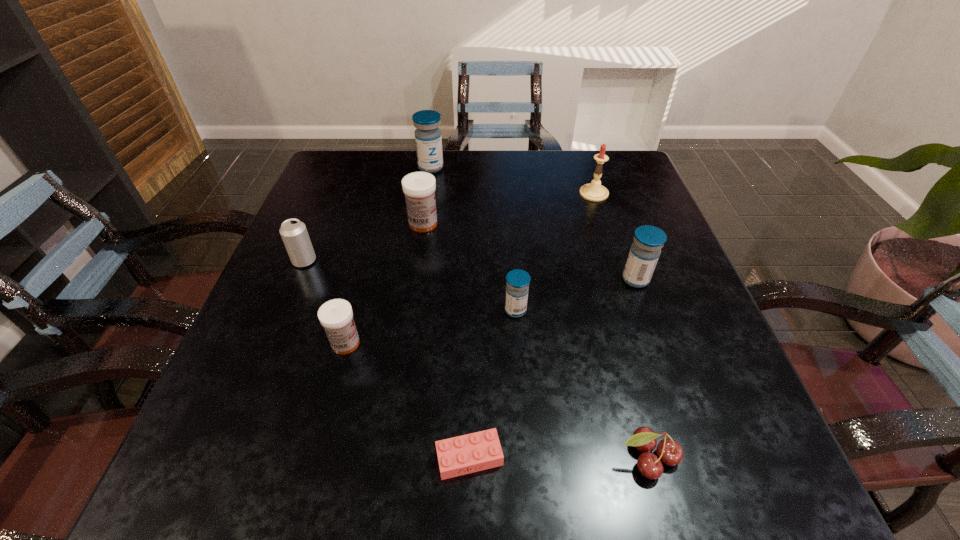
Locate an element on the screen. object that is at the left edge is located at coordinates (294, 234).

At what (x,y) coordinates should I click in order to perform the action: click on candle located at the right edge. Please return your answer as a coordinate pair (x, y). This screenshot has width=960, height=540. Looking at the image, I should click on (594, 191).

You are a GUI agent. You are given a task and a screenshot of the screen. Output one action in this format:
    pyautogui.click(x=<x>, y=<y>)
    Task: Click on the medicine situated at the right edge
    
    Given the screenshot: What is the action you would take?
    pyautogui.click(x=644, y=253)

This screenshot has height=540, width=960. Find the location of `cherry that is at the right edge`. cherry that is at the right edge is located at coordinates (669, 451).

I want to click on object that is at the far right corner, so click(x=594, y=191).

This screenshot has width=960, height=540. What are the coordinates of `object positioned at the near right corner` in the screenshot? It's located at (669, 451).

Image resolution: width=960 pixels, height=540 pixels. In the image, there is a desktop. Identify the location of free space at the far edge. (491, 150).

Locate an element on the screen. This screenshot has width=960, height=540. free space at the left edge of the desktop is located at coordinates (294, 376).

At what (x,y) coordinates should I click in order to perform the action: click on free region at the right edge of the desktop. Please return your answer as a coordinate pair (x, y). The image size is (960, 540). Looking at the image, I should click on (640, 220).

The height and width of the screenshot is (540, 960). What are the coordinates of `vacant space at the far left corner of the desktop` in the screenshot? It's located at (312, 197).